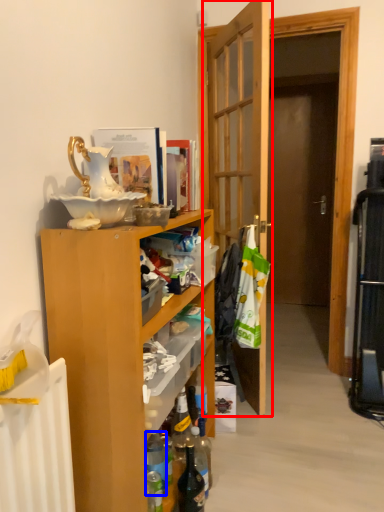
Question: Which point is closer to the camera, door (highlighted by a red box) or bottle (highlighted by a blue box)?

Choices:
 (A) door
 (B) bottle

Answer: (B)